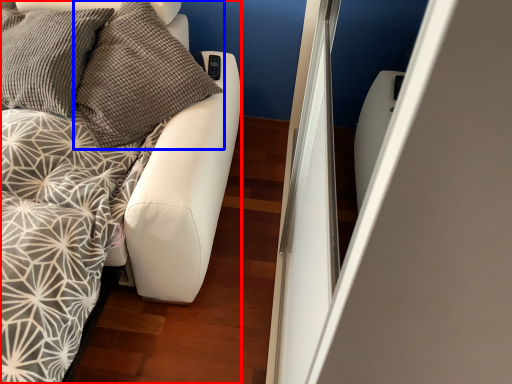
Question: Which point is further to the camera, furniture (highlighted by a red box) or pillow (highlighted by a blue box)?

Choices:
 (A) furniture
 (B) pillow

Answer: (B)